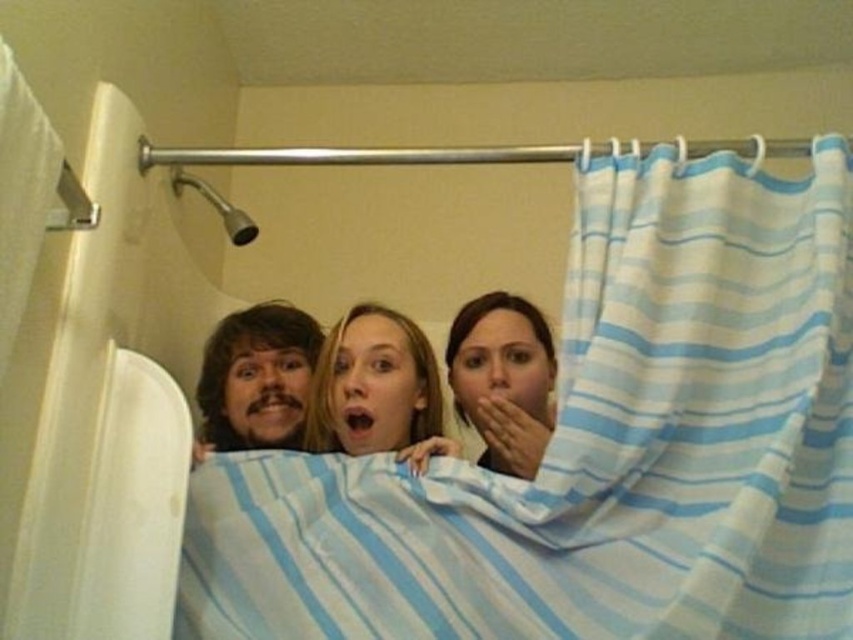
You are a home decorator planning to install a shower curtain in a bathroom. You have two options available to choose from. One is the blue striped fabric at upper center and the other is the white striped shower curtain at left. Based on their heights, which one would you recommend for a standard bathroom ceiling height?

The blue striped fabric at upper center has a greater height compared to the white striped shower curtain at left, so it would be more suitable for a standard bathroom ceiling height as it can reach higher up.

You are trying to find the smooth blue blanket at center in the bathroom scene. According to the image, where is it located in relation to the white striped shower curtain at left?

The smooth blue blanket at center is located below the white striped shower curtain at left.

You are trying to find the blue striped fabric at upper center in the bathroom scene. Since you can see the white striped shower curtain at left, where should you look relative to it?

The blue striped fabric at upper center is to the right of the white striped shower curtain at left, so you should look to the right of the white striped shower curtain at left to find it.